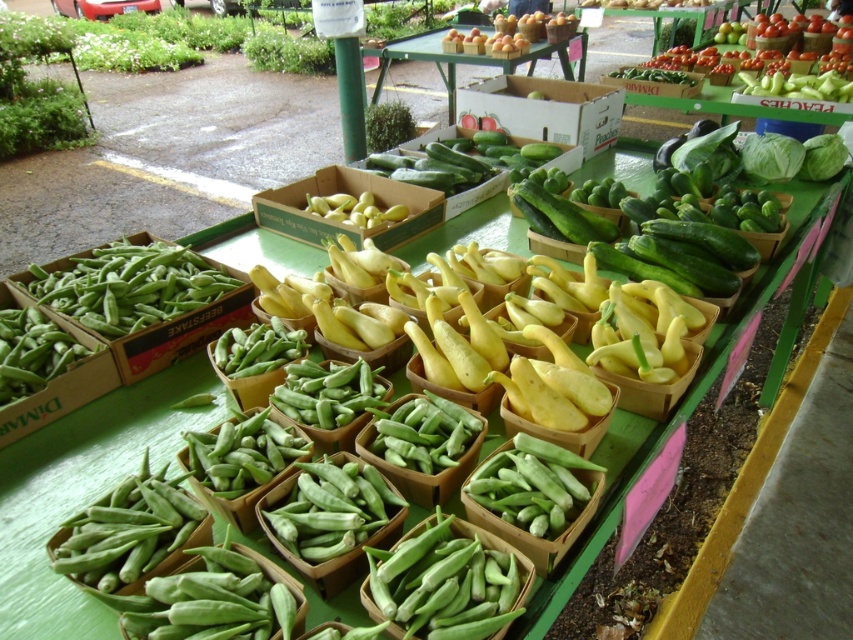
Who is taller, green matte okra at center or green cardboard boxes at upper center?

With more height is green cardboard boxes at upper center.

Does green matte okra at center appear on the right side of green cardboard boxes at upper center?

Incorrect, green matte okra at center is not on the right side of green cardboard boxes at upper center.

Is point (468, 572) less distant than point (386, 42)?

Yes.

The image size is (853, 640). Find the location of `green matte okra at center`. green matte okra at center is located at coordinates (445, 582).

Is green matte okra at left positioned at the back of green cardboard boxes at upper center?

No, green matte okra at left is in front of green cardboard boxes at upper center.

The image size is (853, 640). I want to click on green matte okra at left, so pyautogui.click(x=131, y=285).

Identify the location of green matte okra at left. (131, 285).

Between green matte okra at center and white cardboard box at center, which one is positioned lower?

green matte okra at center is below.

Can you confirm if green matte okra at center is positioned above white cardboard box at center?

No.

You are a GUI agent. You are given a task and a screenshot of the screen. Output one action in this format:
    pyautogui.click(x=<x>, y=<y>)
    Task: Click on the green matte okra at center
    Image resolution: width=853 pixels, height=640 pixels.
    Given the screenshot: What is the action you would take?
    pyautogui.click(x=445, y=582)